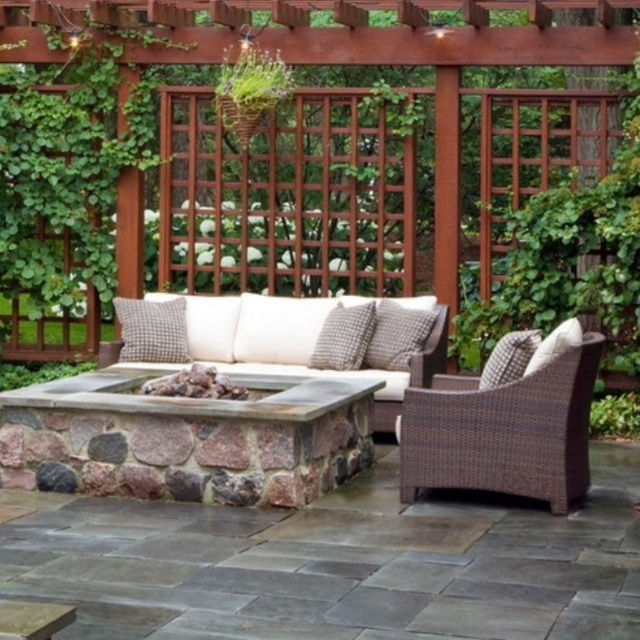
Question: Which point is farther to the camera?

Choices:
 (A) woven fabric pillow at right
 (B) gray woven pillow at center
 (C) checkered fabric pillow at center

Answer: (B)

Question: Is checkered fabric pillow at center positioned in front of white textured pillow at center?

Choices:
 (A) no
 (B) yes

Answer: (B)

Question: Is brown wicker chair at right thinner than woven fabric pillow at right?

Choices:
 (A) no
 (B) yes

Answer: (A)

Question: Which object is closer to the camera taking this photo?

Choices:
 (A) white textured pillow at right
 (B) brown wicker sofa at center

Answer: (A)

Question: Which point is farther to the camera?

Choices:
 (A) (529, 362)
 (B) (429, 348)
 (C) (332, 340)
 (D) (500, 376)

Answer: (C)

Question: Does gray woven pillow at center have a lesser width compared to white textured pillow at center?

Choices:
 (A) yes
 (B) no

Answer: (B)